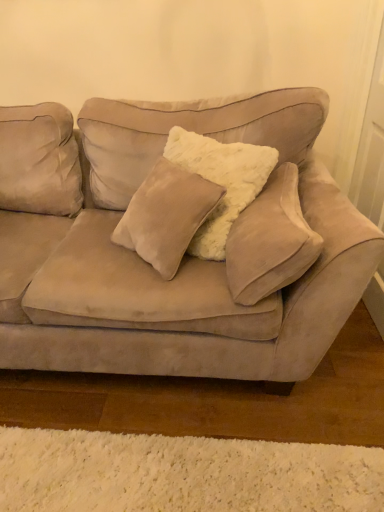
Describe the element at coordinates (185, 255) in the screenshot. I see `suede couch at center` at that location.

Where is `suede couch at center`? The height and width of the screenshot is (512, 384). suede couch at center is located at coordinates (185, 255).

What do you see at coordinates (270, 241) in the screenshot? I see `white fluffy pillow at center` at bounding box center [270, 241].

At what (x,y) coordinates should I click in order to perform the action: click on white fluffy pillow at center. Please return your answer as a coordinate pair (x, y). Image resolution: width=384 pixels, height=512 pixels. Looking at the image, I should click on (270, 241).

Locate an element on the screen. This screenshot has height=512, width=384. suede couch at center is located at coordinates (185, 255).

Considering the positions of objects suede couch at center and white fluffy pillow at center in the image provided, who is more to the left, suede couch at center or white fluffy pillow at center?

From the viewer's perspective, suede couch at center appears more on the left side.

Is the depth of suede couch at center less than that of white fluffy pillow at center?

Yes, suede couch at center is in front of white fluffy pillow at center.

Between point (177, 292) and point (318, 254), which one is positioned behind?

The point (177, 292) is more distant.

From the image's perspective, relative to white fluffy pillow at center, is suede couch at center above or below?

suede couch at center is above white fluffy pillow at center.

From a real-world perspective, between suede couch at center and white fluffy pillow at center, who is vertically lower?

suede couch at center, from a real-world perspective.

In terms of width, does suede couch at center look wider or thinner when compared to white fluffy pillow at center?

Clearly, suede couch at center has more width compared to white fluffy pillow at center.

Between suede couch at center and white fluffy pillow at center, which one has less height?

white fluffy pillow at center.

Can you confirm if suede couch at center is smaller than white fluffy pillow at center?

No.

Is suede couch at center positioned beyond the bounds of white fluffy pillow at center?

Yes, suede couch at center is outside of white fluffy pillow at center.

Is suede couch at center beside white fluffy pillow at center?

suede couch at center and white fluffy pillow at center are clearly separated.

Is suede couch at center facing away from white fluffy pillow at center?

suede couch at center does not have its back to white fluffy pillow at center.

Image resolution: width=384 pixels, height=512 pixels. In order to click on studio couch located in front of the white fluffy pillow at center in this screenshot , I will do `click(185, 255)`.

Which is more to the right, white fluffy pillow at center or suede couch at center?

From the viewer's perspective, white fluffy pillow at center appears more on the right side.

Which object is closer to the camera, white fluffy pillow at center or suede couch at center?

suede couch at center is more forward.

Does point (300, 220) appear closer or farther from the camera than point (65, 256)?

Clearly, point (300, 220) is closer to the camera than point (65, 256).

From the image's perspective, is white fluffy pillow at center positioned above or below suede couch at center?

Based on their image positions, white fluffy pillow at center is located beneath suede couch at center.

From a real-world perspective, which object rests below the other?

suede couch at center.

In the scene shown: Can you confirm if white fluffy pillow at center is thinner than suede couch at center?

Yes, white fluffy pillow at center is thinner than suede couch at center.

Considering the relative sizes of white fluffy pillow at center and suede couch at center in the image provided, is white fluffy pillow at center shorter than suede couch at center?

Yes.

Between white fluffy pillow at center and suede couch at center, which one has smaller size?

white fluffy pillow at center is smaller.

Can we say white fluffy pillow at center lies outside suede couch at center?

No, most part of white fluffy pillow at center lies within suede couch at center.

Is white fluffy pillow at center directly adjacent to suede couch at center?

There is a gap between white fluffy pillow at center and suede couch at center.

Does white fluffy pillow at center turn towards suede couch at center?

Yes, white fluffy pillow at center is turned towards suede couch at center.

How many degrees apart are the facing directions of white fluffy pillow at center and suede couch at center?

The angular difference between white fluffy pillow at center and suede couch at center is 93.8 degrees.

This screenshot has width=384, height=512. Identify the location of studio couch in front of the white fluffy pillow at center. (185, 255).

Identify the location of studio couch in front of the white fluffy pillow at center. The image size is (384, 512). (185, 255).

You are a GUI agent. You are given a task and a screenshot of the screen. Output one action in this format:
    pyautogui.click(x=<x>, y=<y>)
    Task: Click on the studio couch that appears on the left of white fluffy pillow at center
    This screenshot has height=512, width=384.
    Given the screenshot: What is the action you would take?
    pyautogui.click(x=185, y=255)